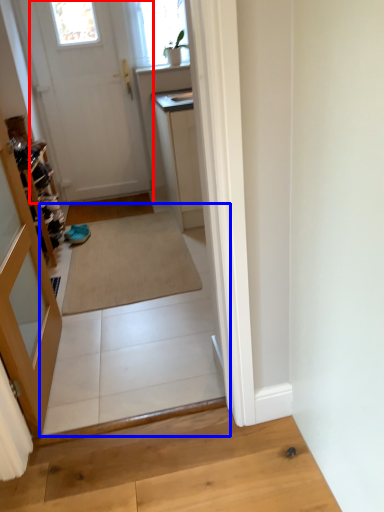
Question: Which of the following is the closest to the observer, door (highlighted by a red box) or path (highlighted by a blue box)?

Choices:
 (A) door
 (B) path

Answer: (B)